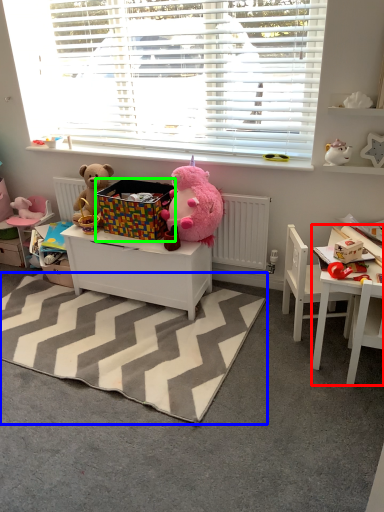
Question: Which object is positioned farthest from table (highlighted by a red box)? Select from mat (highlighted by a blue box) and crate (highlighted by a green box).

Choices:
 (A) mat
 (B) crate

Answer: (B)